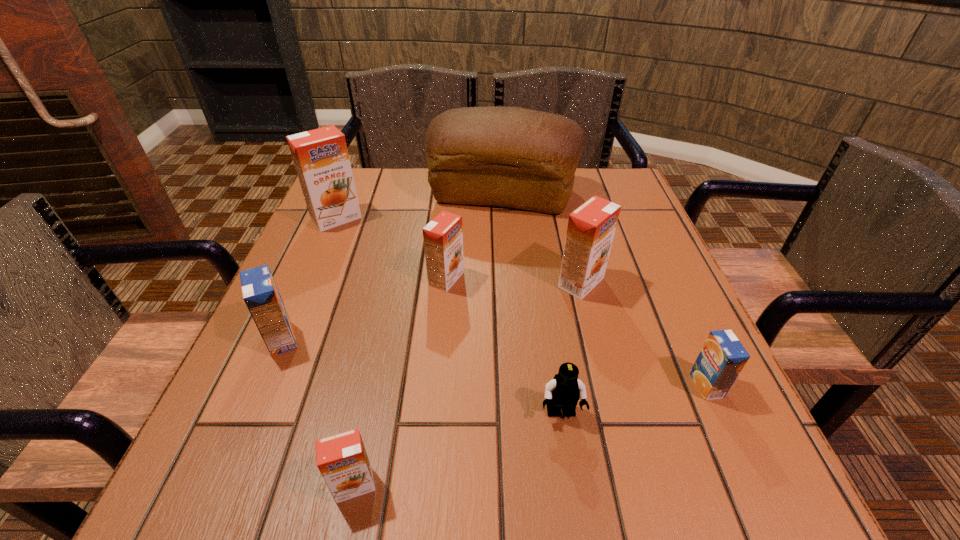
Where is `vacant area located on the back of the right blue orange_juice`? This screenshot has height=540, width=960. vacant area located on the back of the right blue orange_juice is located at coordinates (672, 308).

Where is `vacant space located on the right of the third orange orange juice from right to left`? This screenshot has height=540, width=960. vacant space located on the right of the third orange orange juice from right to left is located at coordinates (621, 485).

Find the location of a particular element. The width and height of the screenshot is (960, 540). bread at the far edge is located at coordinates (513, 157).

Find the location of `orange juice that is positioned at the far edge`. orange juice that is positioned at the far edge is located at coordinates (321, 159).

At what (x,y) coordinates should I click in order to perform the action: click on object that is at the near edge. Please return your answer as a coordinate pair (x, y). The width and height of the screenshot is (960, 540). Looking at the image, I should click on (342, 460).

You are a GUI agent. You are given a task and a screenshot of the screen. Output one action in this format:
    pyautogui.click(x=<x>, y=<y>)
    Task: Click on the bread that is at the right edge
    This screenshot has width=960, height=540.
    Given the screenshot: What is the action you would take?
    pyautogui.click(x=513, y=157)

Identify the location of object at the far left corner. (321, 159).

Where is `object located at the far right corner`? This screenshot has width=960, height=540. object located at the far right corner is located at coordinates (513, 157).

At what (x,y) coordinates should I click in order to perform the action: click on free region at the near edge of the desktop. Please return your answer as a coordinate pair (x, y). The height and width of the screenshot is (540, 960). Looking at the image, I should click on (552, 465).

The width and height of the screenshot is (960, 540). In the image, there is a desktop. In order to click on vacant space at the left edge in this screenshot , I will do `click(215, 440)`.